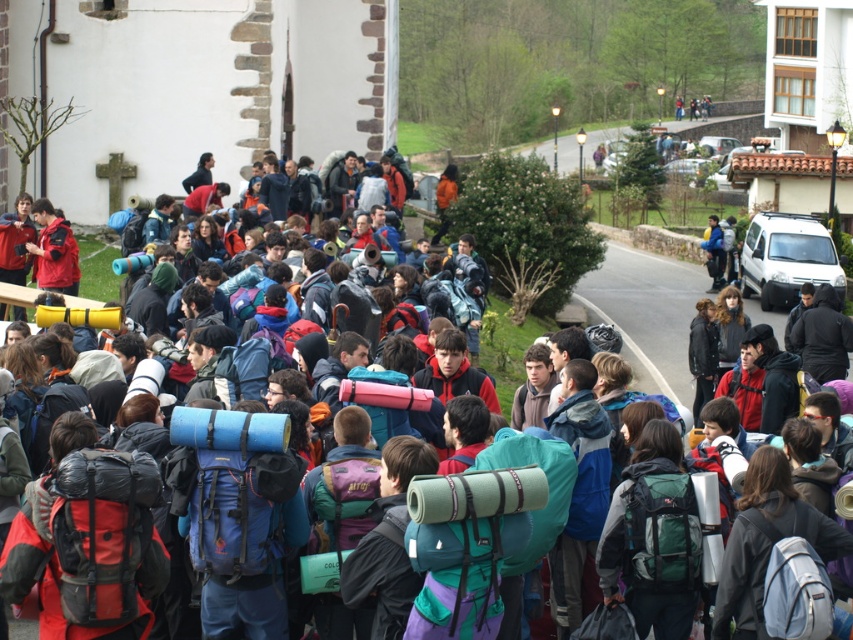
You are standing at the center of the crowd and want to find the blue fabric backpack at center. According to the coordinates provided, where exactly is it positioned?

The blue fabric backpack at center is located at point 0.769 on the x axis and 0.280 on the y axis.

You are organizing a group hike and need to ensure that all backpacks are within the weight limit. The red fabric backpack at center and the green fabric backpack at center are both being carried by hikers. Which backpack might exceed the weight limit if the weight capacity is based on size?

The red fabric backpack at center is bigger than the green fabric backpack at center, so it might exceed the weight limit if the capacity is based on size.

You are part of the group in the image and need to locate your blue fabric backpack at center and green fabric backpack at center. From your perspective, which backpack is positioned to the left?

The blue fabric backpack at center is positioned to the left of the green fabric backpack at center.